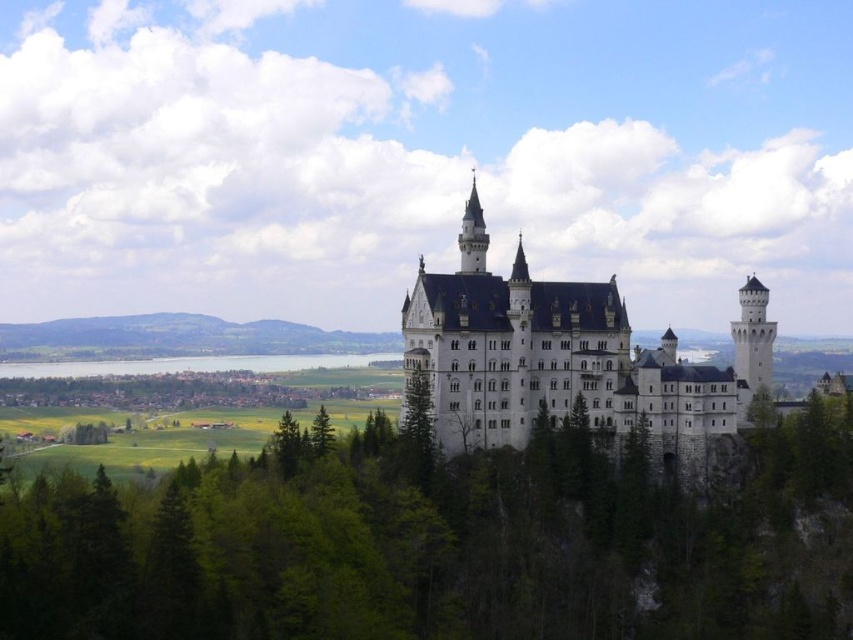
Question: Which point is closer to the camera?

Choices:
 (A) green matte tree at lower center
 (B) white stone castle at center

Answer: (B)

Question: Which point is farther to the camera?

Choices:
 (A) green leafy trees at center
 (B) white stone castle at center
 (C) green matte tree at lower center
 (D) clear blue water at lower center

Answer: (D)

Question: Is green leafy trees at center closer to the viewer compared to green matte tree at lower center?

Choices:
 (A) no
 (B) yes

Answer: (B)

Question: Can you confirm if clear blue water at lower center is thinner than green matte tree at lower center?

Choices:
 (A) no
 (B) yes

Answer: (A)

Question: Is white stone castle at center further to camera compared to clear blue water at lower center?

Choices:
 (A) no
 (B) yes

Answer: (A)

Question: Which object appears closest to the camera in this image?

Choices:
 (A) clear blue water at lower center
 (B) green matte tree at lower center
 (C) green leafy trees at center

Answer: (C)